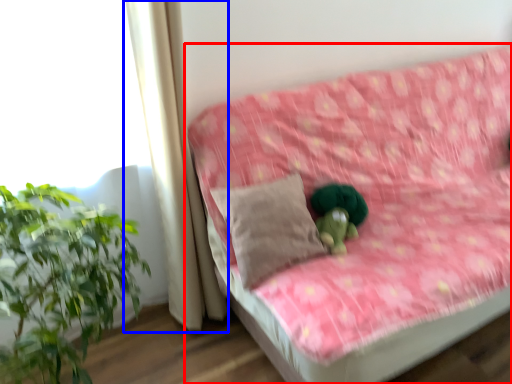
Question: Which object is further to the camera taking this photo, studio couch (highlighted by a red box) or curtain (highlighted by a blue box)?

Choices:
 (A) studio couch
 (B) curtain

Answer: (B)